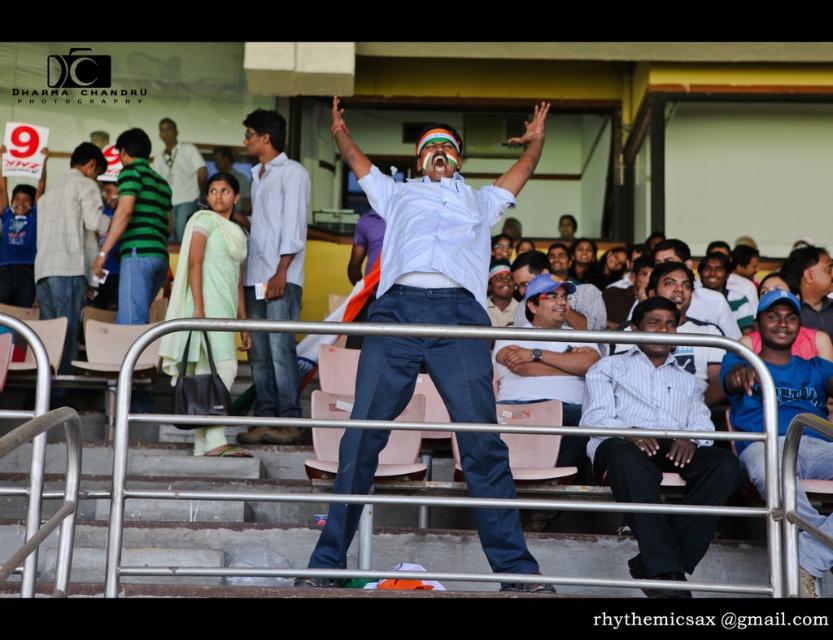
Question: Is metallic silver rail at center below light green fabric saree at center?

Choices:
 (A) no
 (B) yes

Answer: (B)

Question: Does white striped shirt at center appear on the left side of matte green shirt at center?

Choices:
 (A) yes
 (B) no

Answer: (B)

Question: Is blue cotton shirt at center closer to the viewer compared to matte green shirt at center?

Choices:
 (A) no
 (B) yes

Answer: (B)

Question: Estimate the real-world distances between objects in this image. Which object is farther from the white cotton shirt at center?

Choices:
 (A) matte green shirt at center
 (B) metallic silver rail at center

Answer: (A)

Question: Which point is farther from the camera taking this photo?

Choices:
 (A) (73, 189)
 (B) (237, 248)
 (C) (192, 198)
 (D) (382, 419)

Answer: (C)

Question: Which point is farther to the camera?

Choices:
 (A) metallic silver rail at center
 (B) matte green shirt at center

Answer: (B)